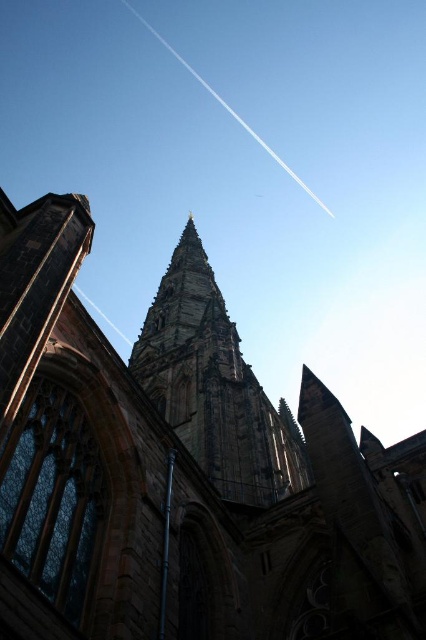
You are an architect analyzing the structure of a historic Gothic church. You observe the dark gray stone church steeple at center and the dark gray stone tower at center. Which structure is higher in height?

The dark gray stone church steeple at center is taller than the dark gray stone tower at center.

You are standing at the camera position and want to take a photo of the dark gray stone church steeple at center. If your camera can focus on objects up to 35 meters away, will it be able to capture the steeple clearly?

The dark gray stone church steeple at center is 36.15 meters away from camera, which is beyond the camera focus limit of 35 meters. Therefore, the camera cannot capture the steeple clearly.

You are standing in front of the historic Gothic church and want to take a photo of the spire. The camera you are using has a maximum focus range of 40 meters. Will the camera be able to focus on the point at coordinates point (x=8, y=262)?

The point at coordinates point (x=8, y=262) is 44.08 meters away from the camera, which exceeds the maximum focus range of 40 meters. Therefore, the camera will not be able to focus on that point.